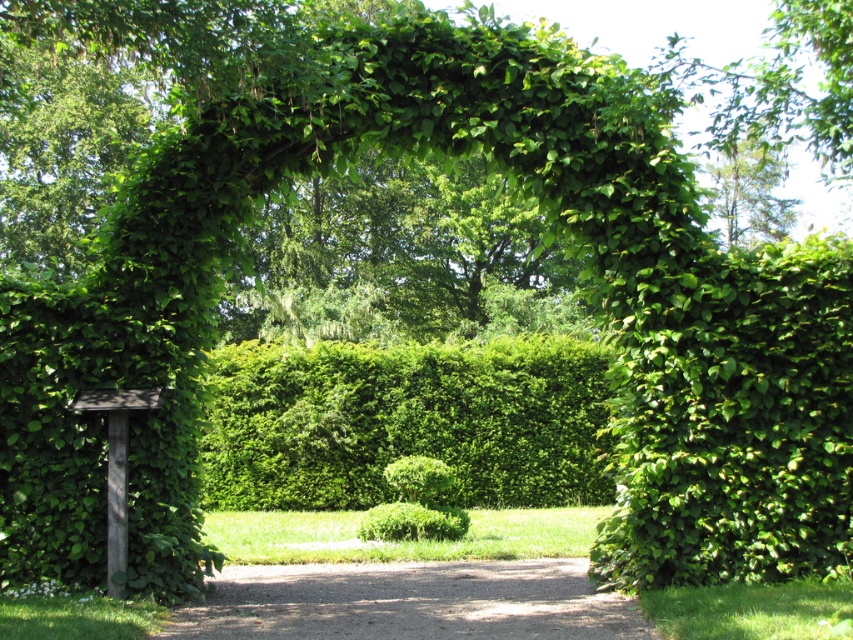
Does green leafy hedge at center appear on the left side of green leafy tree at upper center?

Correct, you'll find green leafy hedge at center to the left of green leafy tree at upper center.

Is green leafy hedge at center taller than green leafy tree at upper center?

In fact, green leafy hedge at center may be shorter than green leafy tree at upper center.

The width and height of the screenshot is (853, 640). In order to click on green leafy hedge at center in this screenshot , I will do coord(405,422).

Who is taller, brown gravel path at center or green leafy tree at upper center?

green leafy tree at upper center is taller.

Which is in front, point (457, 630) or point (738, 140)?

Point (457, 630) is more forward.

Locate an element on the screen. The width and height of the screenshot is (853, 640). brown gravel path at center is located at coordinates (410, 602).

Is green leafy hedge at center smaller than brown gravel path at center?

Yes.

Can you confirm if green leafy hedge at center is positioned to the left of brown gravel path at center?

Yes, green leafy hedge at center is to the left of brown gravel path at center.

The image size is (853, 640). I want to click on green leafy hedge at center, so click(405, 422).